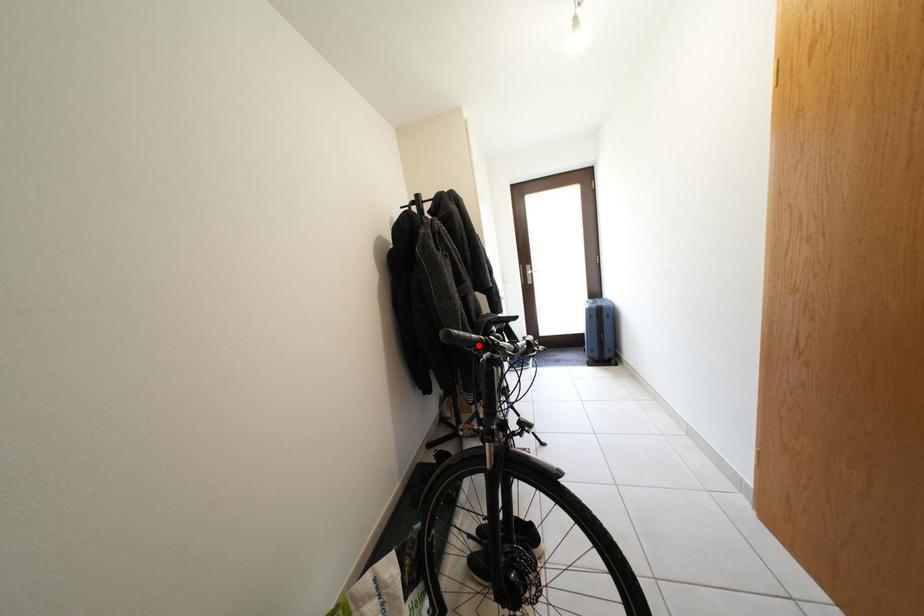
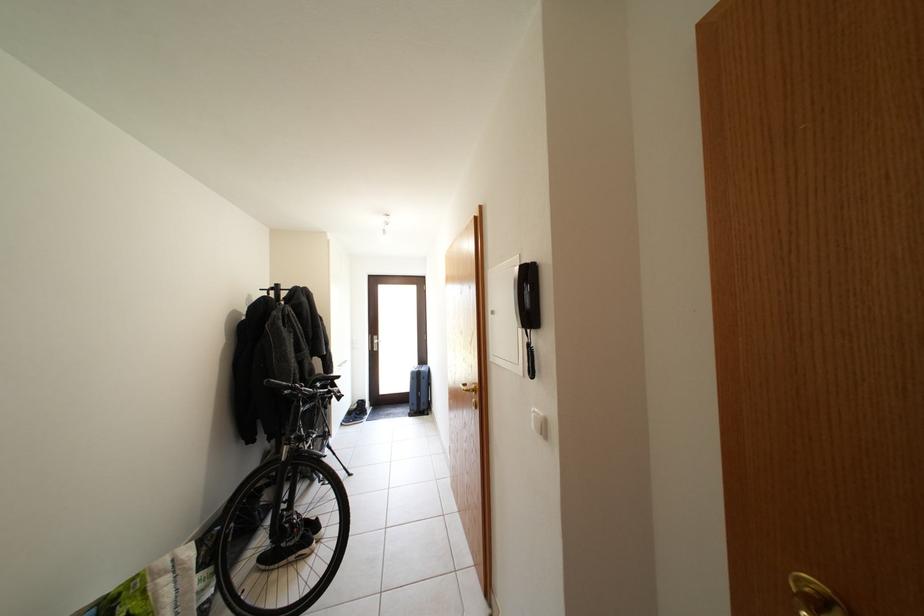
In the second image, find the point that corresponds to the highlighted location in the first image.

(289, 390)